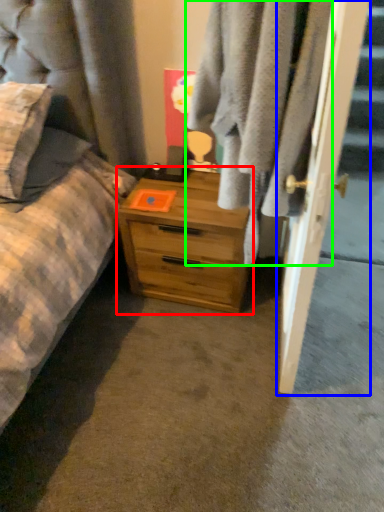
Question: Estimate the real-world distances between objects in this image. Which object is closer to chest of drawers (highlighted by a red box), door (highlighted by a blue box) or clothing (highlighted by a green box)?

Choices:
 (A) door
 (B) clothing

Answer: (B)